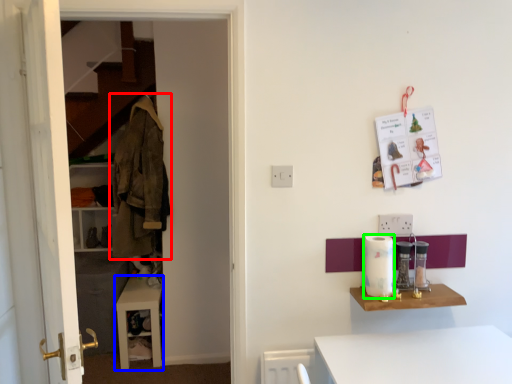
Question: Considering the real-world distances, which object is farthest from clothing (highlighted by a red box)? table (highlighted by a blue box) or appliance (highlighted by a green box)?

Choices:
 (A) table
 (B) appliance

Answer: (B)